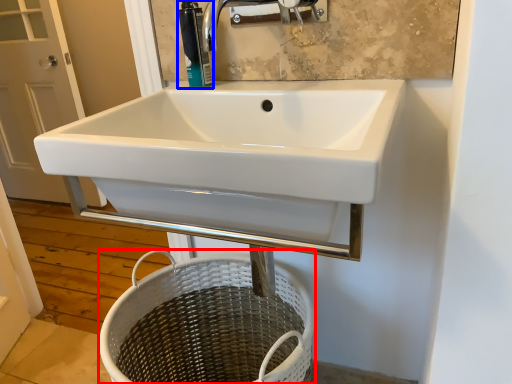
Question: Among these objects, which one is nearest to the camera, basket (highlighted by a red box) or soap dispenser (highlighted by a blue box)?

Choices:
 (A) basket
 (B) soap dispenser

Answer: (A)